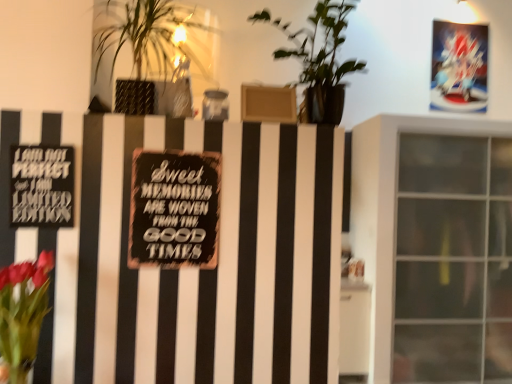
Question: Is black matte sign at center, which is the 2th plaque from front to back, in front of or behind black matte sign at left, marked as the 2th plaque in a right-to-left arrangement, in the image?

Choices:
 (A) front
 (B) behind

Answer: (B)

Question: From their relative heights in the image, would you say black matte sign at center, which appears as the 2th plaque when viewed from the left, is taller or shorter than black matte sign at left, arranged as the first plaque when viewed from the front?

Choices:
 (A) tall
 (B) short

Answer: (A)

Question: Estimate the real-world distances between objects in this image. Which object is closer to the green leafy plant at upper left, which appears as the second houseplant when viewed from the right?

Choices:
 (A) vivid pink petals at lower left
 (B) black matte sign at center, which appears as the 2th plaque when viewed from the left
 (C) green leafy plant at center, which is counted as the first houseplant, starting from the right
 (D) transparent glass window at right
 (E) black matte sign at left, the second plaque in the back-to-front sequence

Answer: (C)

Question: Considering the real-world distances, which object is farthest from the transparent glass window at right?

Choices:
 (A) green leafy plant at center, which is counted as the second houseplant, starting from the left
 (B) black matte sign at center, which appears as the 1th plaque when viewed from the back
 (C) vivid pink petals at lower left
 (D) black matte sign at left, arranged as the first plaque when viewed from the front
 (E) green leafy plant at upper left, which appears as the second houseplant when viewed from the right

Answer: (C)